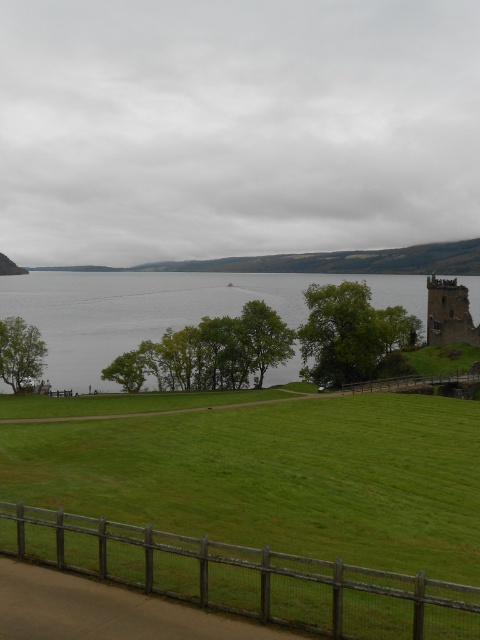
Question: Based on their relative distances, which object is farther from the brown stone castle at right?

Choices:
 (A) wooden at right
 (B) wooden fence at lower center

Answer: (B)

Question: Which point is farther to the camera?

Choices:
 (A) brown stone castle at right
 (B) wooden at right

Answer: (A)

Question: Is brown stone castle at right to the left of wooden at right from the viewer's perspective?

Choices:
 (A) no
 (B) yes

Answer: (A)

Question: Which of these objects is positioned closest to the wooden fence at lower center?

Choices:
 (A) wooden at right
 (B) brown stone castle at right

Answer: (A)

Question: Can you confirm if gray water at center is positioned to the right of wooden at right?

Choices:
 (A) no
 (B) yes

Answer: (A)

Question: Does wooden fence at lower center appear under brown stone castle at right?

Choices:
 (A) no
 (B) yes

Answer: (B)